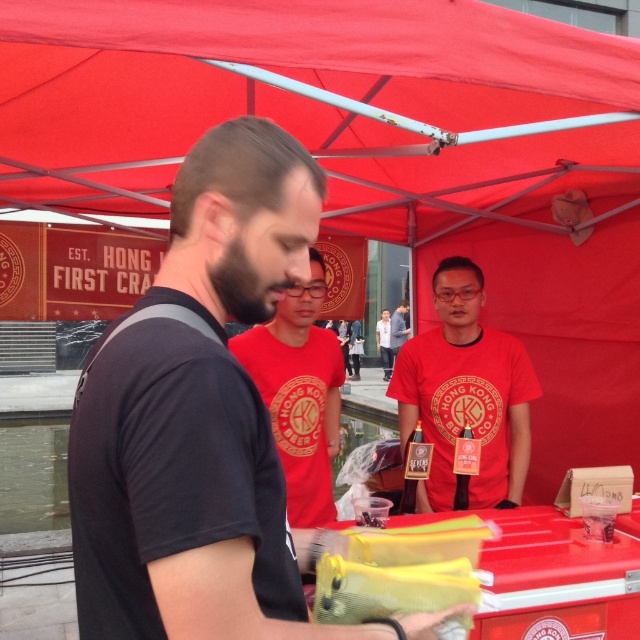
Question: Can you confirm if black matte t-shirt at center is bigger than white cotton shirt at center?

Choices:
 (A) yes
 (B) no

Answer: (B)

Question: Which object is farther from the camera taking this photo?

Choices:
 (A) red matte shirt at center
 (B) matte red t-shirt at center
 (C) black matte t-shirt at center

Answer: (B)

Question: Among these points, which one is nearest to the camera?

Choices:
 (A) (493, 493)
 (B) (186, 358)
 (C) (392, 346)
 (D) (275, 372)

Answer: (B)

Question: Estimate the real-world distances between objects in this image. Which object is farther from the red matte shirt at center?

Choices:
 (A) matte red t-shirt at center
 (B) black matte t-shirt at center
 (C) white cotton shirt at center

Answer: (C)

Question: Observing the image, what is the correct spatial positioning of black matte t-shirt at center in reference to matte red t-shirt at center?

Choices:
 (A) left
 (B) right

Answer: (A)

Question: Does red matte shirt at center have a larger size compared to white cotton shirt at center?

Choices:
 (A) no
 (B) yes

Answer: (A)